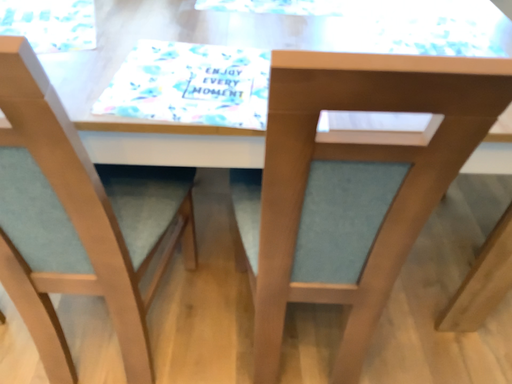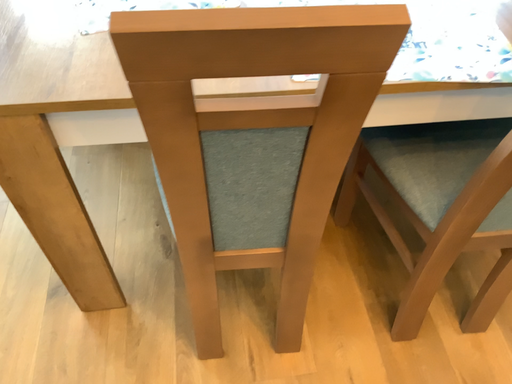
Question: Which way did the camera rotate in the video?

Choices:
 (A) rotated upward
 (B) rotated downward

Answer: (B)